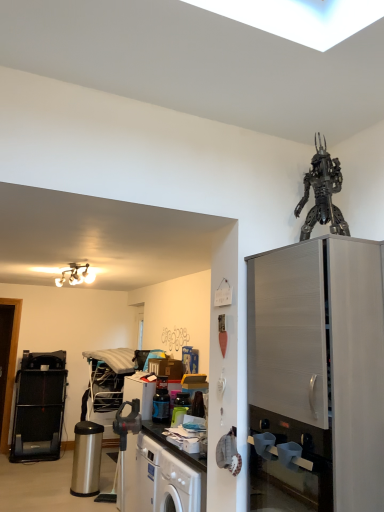
Identify the location of free space above metallic/reflective chandelier at upper left (from a real-world perspective). Image resolution: width=384 pixels, height=512 pixels. (74, 266).